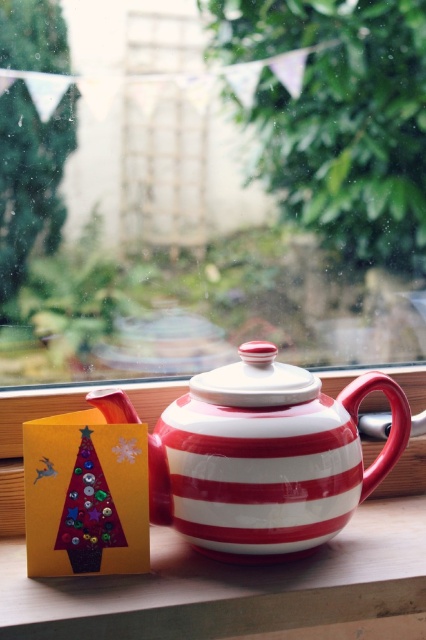
Does transparent glass window at center appear on the left side of red and white striped teapot at center?

Yes, transparent glass window at center is to the left of red and white striped teapot at center.

The image size is (426, 640). Identify the location of transparent glass window at center. (213, 189).

Locate an element on the screen. The image size is (426, 640). transparent glass window at center is located at coordinates (213, 189).

Where is `transparent glass window at center`? Image resolution: width=426 pixels, height=640 pixels. transparent glass window at center is located at coordinates (213, 189).

Who is taller, red and white striped teapot at center or wooden ledge at lower left?

With more height is red and white striped teapot at center.

The height and width of the screenshot is (640, 426). Describe the element at coordinates (265, 456) in the screenshot. I see `red and white striped teapot at center` at that location.

I want to click on red and white striped teapot at center, so click(x=265, y=456).

Is transparent glass window at center thinner than wooden ledge at lower left?

No.

Is point (199, 259) farther from viewer compared to point (304, 604)?

That is True.

Which is in front, point (71, 259) or point (356, 600)?

Positioned in front is point (356, 600).

Where is `transparent glass window at center`? Image resolution: width=426 pixels, height=640 pixels. transparent glass window at center is located at coordinates (213, 189).